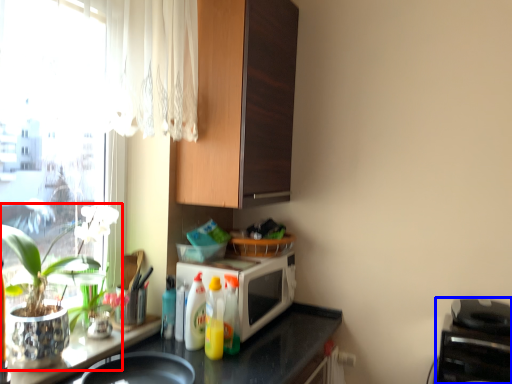
Question: Which object appears farthest to the camera in this image, houseplant (highlighted by a red box) or appliance (highlighted by a blue box)?

Choices:
 (A) houseplant
 (B) appliance

Answer: (B)